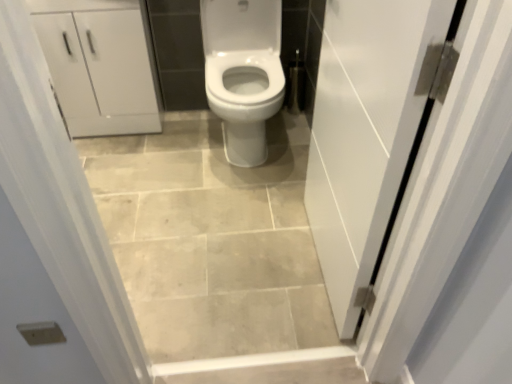
Question: Would you say white matte cabinet at upper left is part of white glossy door at right's contents?

Choices:
 (A) no
 (B) yes

Answer: (A)

Question: Could you tell me if white glossy door at right is turned towards white matte cabinet at upper left?

Choices:
 (A) yes
 (B) no

Answer: (B)

Question: Considering the relative sizes of white glossy door at right and white matte cabinet at upper left in the image provided, is white glossy door at right bigger than white matte cabinet at upper left?

Choices:
 (A) yes
 (B) no

Answer: (B)

Question: From the image's perspective, is white glossy door at right on white matte cabinet at upper left?

Choices:
 (A) yes
 (B) no

Answer: (B)

Question: From a real-world perspective, does white glossy door at right stand above white matte cabinet at upper left?

Choices:
 (A) no
 (B) yes

Answer: (B)

Question: From the image's perspective, is beige ceramic tile at center above or below white glossy door at right?

Choices:
 (A) below
 (B) above

Answer: (A)

Question: Is point (276, 130) positioned closer to the camera than point (326, 94)?

Choices:
 (A) closer
 (B) farther

Answer: (B)

Question: Is beige ceramic tile at center inside or outside of white glossy door at right?

Choices:
 (A) inside
 (B) outside

Answer: (B)

Question: Based on their sizes in the image, would you say beige ceramic tile at center is bigger or smaller than white glossy door at right?

Choices:
 (A) small
 (B) big

Answer: (A)

Question: In the image, is white glossy door at right positioned in front of or behind beige ceramic tile at center?

Choices:
 (A) front
 (B) behind

Answer: (A)

Question: Based on their sizes in the image, would you say white glossy door at right is bigger or smaller than beige ceramic tile at center?

Choices:
 (A) small
 (B) big

Answer: (B)

Question: From the image's perspective, is white glossy door at right above or below beige ceramic tile at center?

Choices:
 (A) above
 (B) below

Answer: (A)

Question: Is white glossy door at right spatially inside beige ceramic tile at center, or outside of it?

Choices:
 (A) inside
 (B) outside

Answer: (B)

Question: From the image's perspective, is beige ceramic tile at center positioned above or below white matte cabinet at upper left?

Choices:
 (A) above
 (B) below

Answer: (B)

Question: From a real-world perspective, is beige ceramic tile at center above or below white matte cabinet at upper left?

Choices:
 (A) below
 (B) above

Answer: (A)